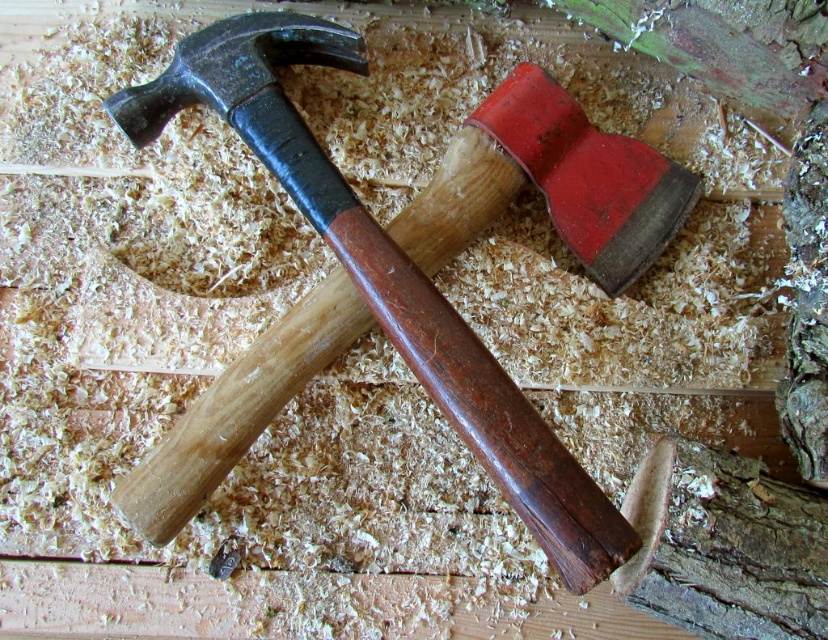
Measure the distance from matte black hammer at upper left to smooth bark tree trunk at lower right.

The distance of matte black hammer at upper left from smooth bark tree trunk at lower right is 10.80 inches.

Who is taller, matte black hammer at upper left or smooth bark tree trunk at lower right?

matte black hammer at upper left

Locate an element on the screen. The width and height of the screenshot is (828, 640). matte black hammer at upper left is located at coordinates (366, 291).